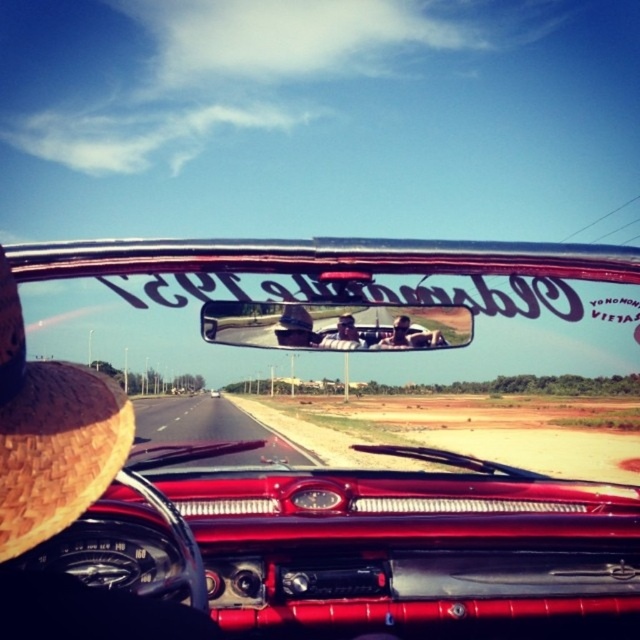
Question: Which point is closer to the camera?

Choices:
 (A) (243, 544)
 (B) (186, 419)
 (C) (216, 392)

Answer: (A)

Question: Is shiny red car at center bigger than asphalt road at center?

Choices:
 (A) yes
 (B) no

Answer: (A)

Question: Which object is closer to the camera taking this photo?

Choices:
 (A) asphalt road at center
 (B) brown woven straw hat at left
 (C) shiny chrome car at center
 (D) metallic chrome rearview mirror at center

Answer: (B)

Question: Is metallic chrome rearview mirror at center smaller than asphalt road at center?

Choices:
 (A) no
 (B) yes

Answer: (B)

Question: Which object is the closest to the asphalt road at center?

Choices:
 (A) shiny chrome car at center
 (B) shiny red car at center
 (C) brown woven straw hat at left

Answer: (B)

Question: Where is shiny red car at center located in relation to brown woven straw hat at left in the image?

Choices:
 (A) above
 (B) below

Answer: (B)